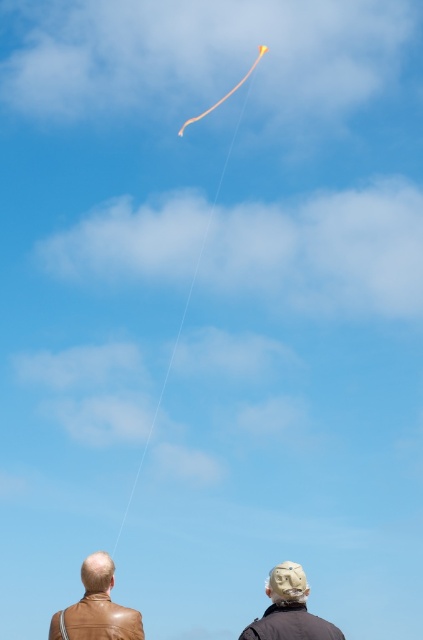
Question: Considering the relative positions of brown leather jacket at lower left and orange string at upper center in the image provided, where is brown leather jacket at lower left located with respect to orange string at upper center?

Choices:
 (A) left
 (B) right

Answer: (B)

Question: Based on their relative distances, which object is farther from the orange string at upper center?

Choices:
 (A) brown leather jacket at lower left
 (B) matte black jacket at lower center

Answer: (A)

Question: Is brown leather jacket at lower left above yellow matte kite at upper center?

Choices:
 (A) yes
 (B) no

Answer: (B)

Question: Which point appears closest to the camera in this image?

Choices:
 (A) (137, 636)
 (B) (227, 96)

Answer: (A)

Question: Can you confirm if brown leather jacket at lower left is positioned below yellow matte kite at upper center?

Choices:
 (A) no
 (B) yes

Answer: (B)

Question: Estimate the real-world distances between objects in this image. Which object is farther from the yellow matte kite at upper center?

Choices:
 (A) orange string at upper center
 (B) matte black jacket at lower center

Answer: (B)